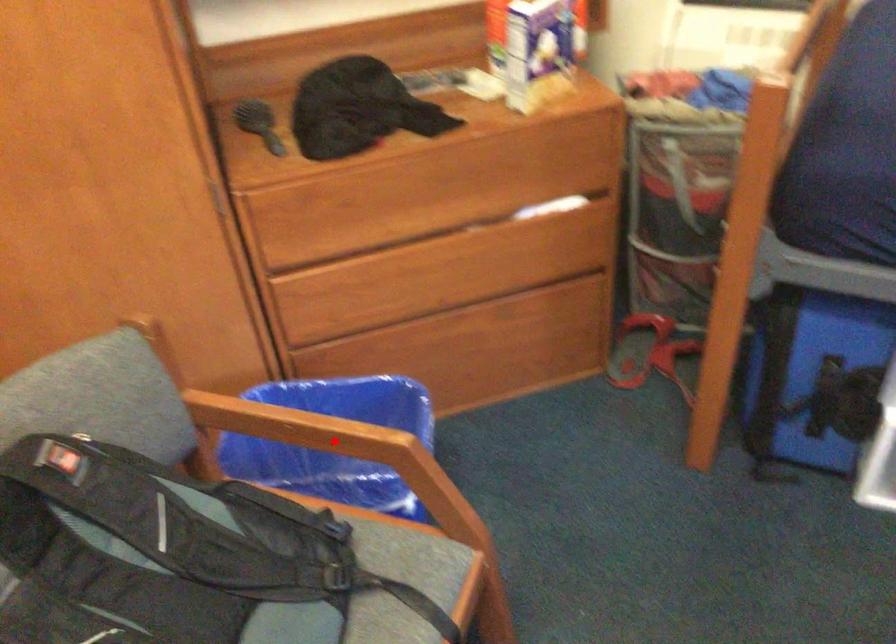
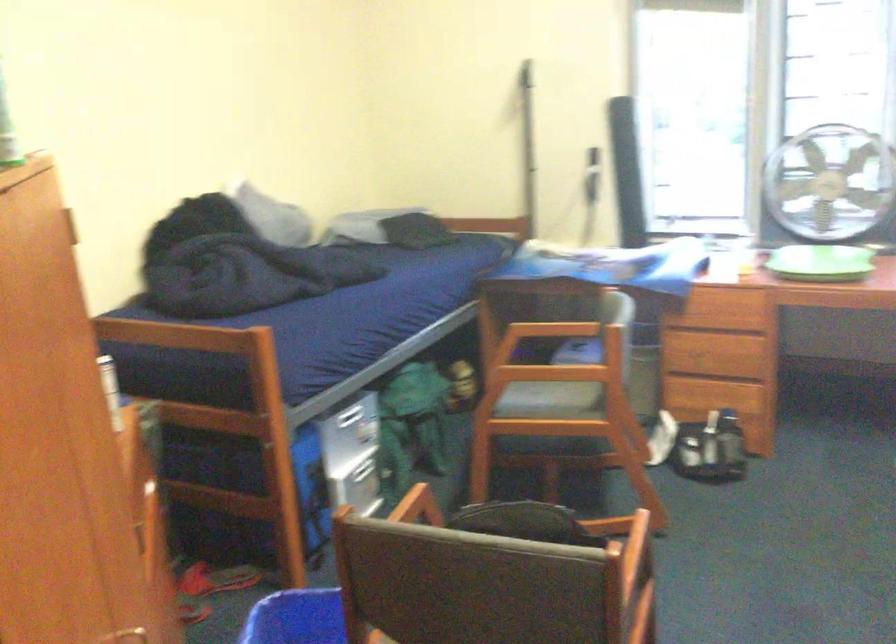
Question: I am providing you with two images of the same scene from different viewpoints. A red point is marked on the first image. Can you still see the location of the red point in image 2?

Choices:
 (A) Yes
 (B) No

Answer: (B)